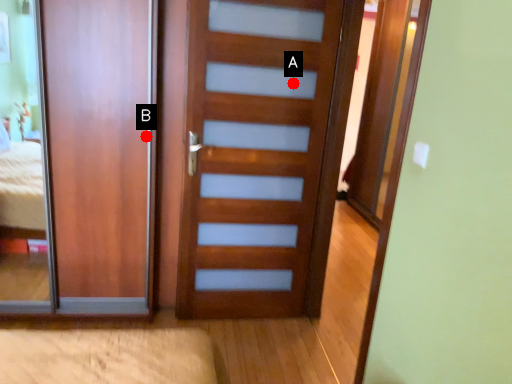
Question: Two points are circled on the image, labeled by A and B beside each circle. Which point is farther from the camera taking this photo?

Choices:
 (A) A is further
 (B) B is further

Answer: (A)